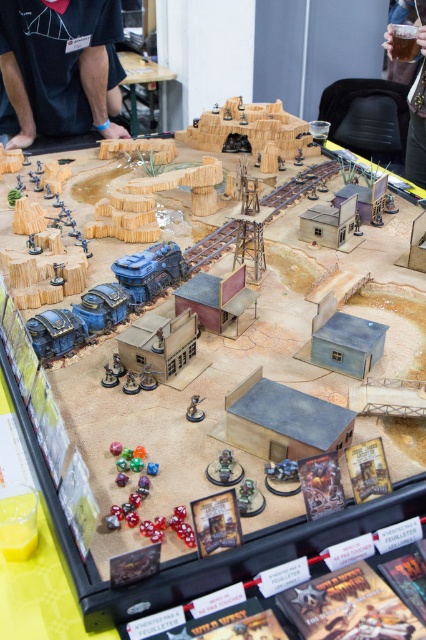
Question: Which point appears farthest from the camera in this image?

Choices:
 (A) (123, 61)
 (B) (187, 417)

Answer: (A)

Question: Can you confirm if black fabric at upper left is positioned to the right of wooden table at upper center?

Choices:
 (A) yes
 (B) no

Answer: (B)

Question: Considering the relative positions of black fabric at upper left and wooden table at upper center in the image provided, where is black fabric at upper left located with respect to wooden table at upper center?

Choices:
 (A) right
 (B) left

Answer: (B)

Question: Which point appears farthest from the camera in this image?

Choices:
 (A) (152, 80)
 (B) (92, 81)
 (C) (414, 150)
 (D) (187, 416)

Answer: (A)

Question: Estimate the real-world distances between objects in this image. Which object is closer to the black fabric at upper left?

Choices:
 (A) translucent plastic cup at upper right
 (B) wooden table at upper center

Answer: (B)

Question: Is black fabric at upper left to the left of metallic silver figure at center from the viewer's perspective?

Choices:
 (A) no
 (B) yes

Answer: (B)